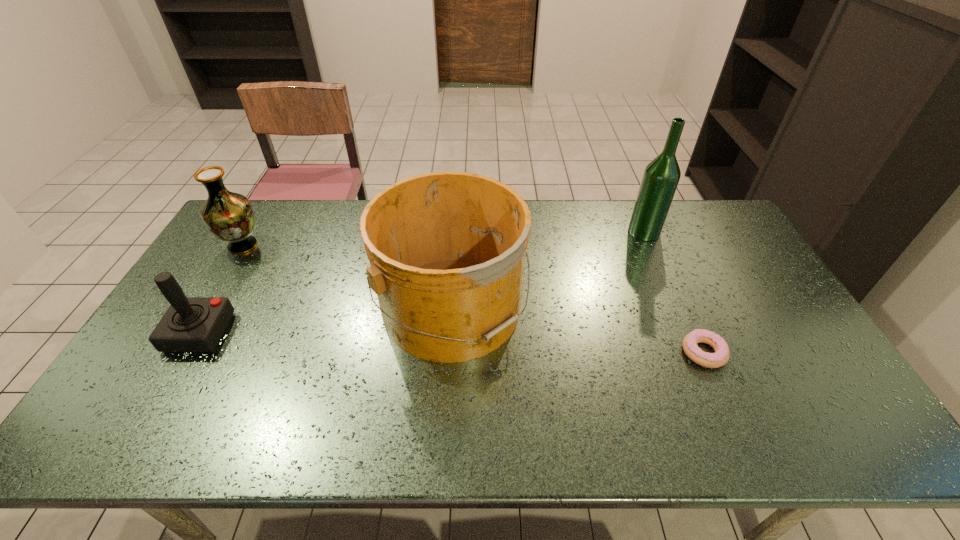
The height and width of the screenshot is (540, 960). Find the location of `alcohol situated at the far edge`. alcohol situated at the far edge is located at coordinates (661, 176).

This screenshot has height=540, width=960. What are the coordinates of `vase that is positioned at the far edge` in the screenshot? It's located at (229, 216).

Locate an element on the screen. This screenshot has width=960, height=540. vase that is at the left edge is located at coordinates (229, 216).

The height and width of the screenshot is (540, 960). I want to click on joystick that is at the left edge, so click(x=191, y=324).

Locate an element on the screen. The width and height of the screenshot is (960, 540). object located at the far left corner is located at coordinates (229, 216).

This screenshot has width=960, height=540. In the image, there is a desktop. Identify the location of vacant space at the far edge. (597, 207).

In order to click on vacant area at the near edge in this screenshot , I will do `click(581, 415)`.

In the image, there is a desktop. Where is `vacant space at the left edge`? This screenshot has height=540, width=960. vacant space at the left edge is located at coordinates (157, 369).

Locate an element on the screen. vacant space at the right edge of the desktop is located at coordinates (708, 260).

Find the location of a particular element. empty location between the shortest object and the tallest object is located at coordinates (674, 292).